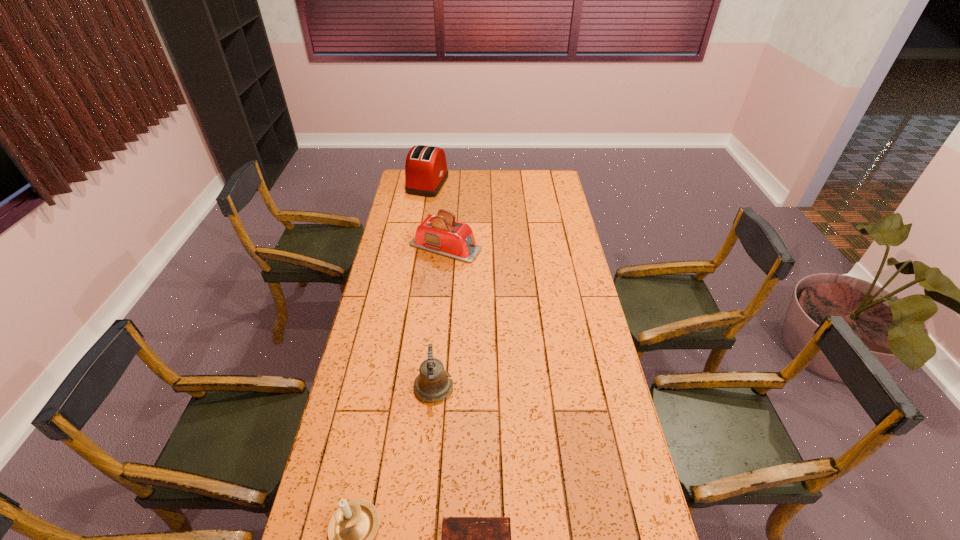
I want to click on the farthest object, so click(426, 171).

The width and height of the screenshot is (960, 540). Find the location of `the nearer toaster`. the nearer toaster is located at coordinates (440, 234).

Image resolution: width=960 pixels, height=540 pixels. I want to click on bell, so click(x=431, y=385).

I want to click on vacant point located on the front of the farther toaster, so click(x=424, y=205).

What are the coordinates of `vacant space situated 0.390m on the front of the nearer toaster` in the screenshot? It's located at (438, 332).

Find the location of `vacant position located on the front of the third farthest object`. vacant position located on the front of the third farthest object is located at coordinates (420, 534).

Locate an element on the screen. The width and height of the screenshot is (960, 540). object present at the far edge is located at coordinates (426, 171).

Where is `object positioned at the far left corner`? The height and width of the screenshot is (540, 960). object positioned at the far left corner is located at coordinates (426, 171).

I want to click on vacant area at the left edge, so click(383, 382).

At what (x,y) coordinates should I click in order to perform the action: click on free space at the right edge of the desktop. Please return your answer as a coordinate pair (x, y). Looking at the image, I should click on (570, 248).